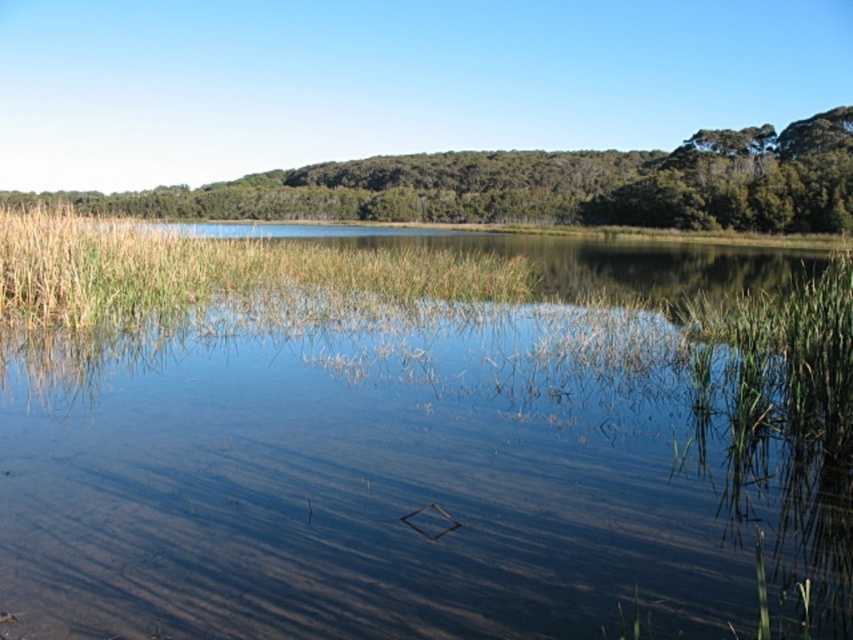
Is green leafy tree at upper center below green grass at center?

Incorrect, green leafy tree at upper center is not positioned below green grass at center.

Where is `green leafy tree at upper center`? The width and height of the screenshot is (853, 640). green leafy tree at upper center is located at coordinates [541, 186].

Find the location of a particular element. This screenshot has height=640, width=853. green leafy tree at upper center is located at coordinates pos(541,186).

Is clear water at center further to the viewer compared to green grass at center?

No.

At what (x,y) coordinates should I click in order to perform the action: click on clear water at center. Please return your answer as a coordinate pair (x, y). Image resolution: width=853 pixels, height=640 pixels. Looking at the image, I should click on (399, 483).

Which is behind, point (245, 470) or point (308, 288)?

The point (308, 288) is more distant.

You are a GUI agent. You are given a task and a screenshot of the screen. Output one action in this format:
    pyautogui.click(x=<x>, y=<y>)
    Task: Click on the clear water at center
    The height and width of the screenshot is (640, 853).
    Given the screenshot: What is the action you would take?
    pyautogui.click(x=399, y=483)

Which is above, clear water at center or green leafy tree at upper center?

green leafy tree at upper center is above.

Is point (450, 637) less distant than point (460, 188)?

Yes, point (450, 637) is closer to viewer.

Locate an element on the screen. clear water at center is located at coordinates (399, 483).